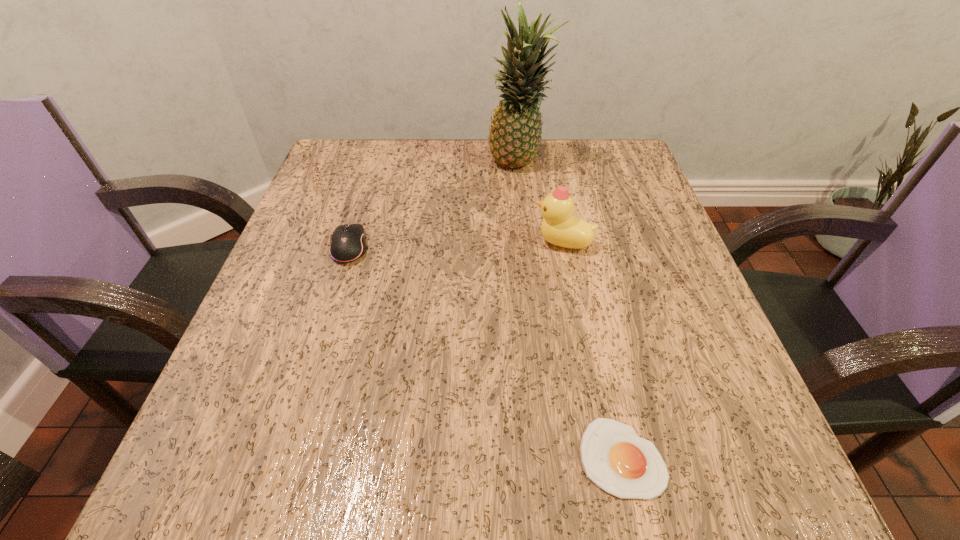
You are a GUI agent. You are given a task and a screenshot of the screen. Output one action in this format:
    pyautogui.click(x=<x>, y=<y>)
    Task: Click on the free location located 0.220m on the front-facing side of the duckling
    
    Given the screenshot: What is the action you would take?
    pyautogui.click(x=419, y=242)

You are a GUI agent. You are given a task and a screenshot of the screen. Output one action in this format:
    pyautogui.click(x=<x>, y=<y>)
    Task: Click on the vacant space situated on the front of the leftmost object
    
    Given the screenshot: What is the action you would take?
    pyautogui.click(x=305, y=395)

Locate an element on the screen. The image size is (960, 540). vacant space located on the back of the shortest object is located at coordinates (575, 246).

What are the coordinates of `object present at the far edge` in the screenshot? It's located at (515, 133).

Find the location of `object at the near edge`. object at the near edge is located at coordinates (623, 464).

Locate an element on the screen. object positioned at the left edge is located at coordinates (347, 243).

Locate an element on the screen. The height and width of the screenshot is (540, 960). duckling that is at the right edge is located at coordinates (560, 227).

At what (x,y) coordinates should I click in order to perform the action: click on egg yolk located at the right edge. Please return your answer as a coordinate pair (x, y). This screenshot has height=540, width=960. Looking at the image, I should click on (623, 464).

Identify the location of object that is at the near right corner. (623, 464).

Find the location of a particular element. The height and width of the screenshot is (540, 960). vacant space at the far edge is located at coordinates (468, 186).